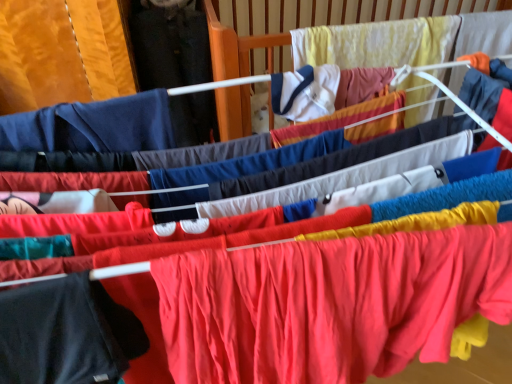
This screenshot has height=384, width=512. What do you see at coordinates (329, 304) in the screenshot? I see `matte red fabric at center, which is the 1th clothing from right to left` at bounding box center [329, 304].

Measure the distance between black matte t-shirt at lower left, positioned as the second clothing in right-to-left order, and camera.

They are 18.64 inches apart.

This screenshot has height=384, width=512. I want to click on black matte t-shirt at lower left, positioned as the second clothing in right-to-left order, so click(66, 333).

The height and width of the screenshot is (384, 512). Find the location of `yellow fabric infant bed at upper center`. yellow fabric infant bed at upper center is located at coordinates (237, 46).

Does black matte t-shirt at lower left, positioned as the second clothing in right-to-left order, have a greater width compared to matte red fabric at center, arranged as the second clothing when viewed from the left?

No.

Visually, is black matte t-shirt at lower left, acting as the first clothing starting from the left, positioned to the left or to the right of matte red fabric at center, arranged as the second clothing when viewed from the left?

Clearly, black matte t-shirt at lower left, acting as the first clothing starting from the left, is on the left of matte red fabric at center, arranged as the second clothing when viewed from the left, in the image.

How distant is black matte t-shirt at lower left, acting as the first clothing starting from the left, from matte red fabric at center, which is the 1th clothing from right to left?

black matte t-shirt at lower left, acting as the first clothing starting from the left, is 9.15 inches away from matte red fabric at center, which is the 1th clothing from right to left.

Considering the sizes of black matte t-shirt at lower left, acting as the first clothing starting from the left, and matte red fabric at center, which is the 1th clothing from right to left, in the image, is black matte t-shirt at lower left, acting as the first clothing starting from the left, taller or shorter than matte red fabric at center, which is the 1th clothing from right to left,?

Clearly, black matte t-shirt at lower left, acting as the first clothing starting from the left, is shorter compared to matte red fabric at center, which is the 1th clothing from right to left.

From a real-world perspective, is yellow fabric infant bed at upper center over black matte t-shirt at lower left, positioned as the second clothing in right-to-left order?

Indeed, from a real-world perspective, yellow fabric infant bed at upper center stands above black matte t-shirt at lower left, positioned as the second clothing in right-to-left order.

Considering the positions of objects yellow fabric infant bed at upper center and black matte t-shirt at lower left, positioned as the second clothing in right-to-left order, in the image provided, who is more to the left, yellow fabric infant bed at upper center or black matte t-shirt at lower left, positioned as the second clothing in right-to-left order,?

black matte t-shirt at lower left, positioned as the second clothing in right-to-left order, is more to the left.

The width and height of the screenshot is (512, 384). What are the coordinates of `infant bed that appears behind the black matte t-shirt at lower left, positioned as the second clothing in right-to-left order` in the screenshot? It's located at (237, 46).

In the scene shown: Which is less distant, [240,66] or [48,371]?

Point [240,66] appears to be farther away from the viewer than point [48,371].

Is black matte t-shirt at lower left, positioned as the second clothing in right-to-left order, in front of or behind yellow fabric infant bed at upper center in the image?

In the image, black matte t-shirt at lower left, positioned as the second clothing in right-to-left order, appears in front of yellow fabric infant bed at upper center.

Is black matte t-shirt at lower left, positioned as the second clothing in right-to-left order, taller than yellow fabric infant bed at upper center?

In fact, black matte t-shirt at lower left, positioned as the second clothing in right-to-left order, may be shorter than yellow fabric infant bed at upper center.

Is black matte t-shirt at lower left, acting as the first clothing starting from the left, facing away from yellow fabric infant bed at upper center?

No, black matte t-shirt at lower left, acting as the first clothing starting from the left, is not facing away from yellow fabric infant bed at upper center.

From the yellow fabric infant bed at upper center, count 1st clothings forward and point to it. Please provide its 2D coordinates.

[(329, 304)]

From a real-world perspective, which is physically below, yellow fabric infant bed at upper center or matte red fabric at center, which is the 1th clothing from right to left?

matte red fabric at center, which is the 1th clothing from right to left.

How far apart are yellow fabric infant bed at upper center and matte red fabric at center, arranged as the second clothing when viewed from the left?

The distance of yellow fabric infant bed at upper center from matte red fabric at center, arranged as the second clothing when viewed from the left, is 29.56 inches.

How different are the orientations of yellow fabric infant bed at upper center and matte red fabric at center, arranged as the second clothing when viewed from the left, in degrees?

1.07 degrees separate the facing orientations of yellow fabric infant bed at upper center and matte red fabric at center, arranged as the second clothing when viewed from the left.

Is matte red fabric at center, which is the 1th clothing from right to left, facing towards black matte t-shirt at lower left, acting as the first clothing starting from the left?

No, matte red fabric at center, which is the 1th clothing from right to left, is not aimed at black matte t-shirt at lower left, acting as the first clothing starting from the left.

Locate an element on the screen. This screenshot has width=512, height=384. clothing that is behind the black matte t-shirt at lower left, positioned as the second clothing in right-to-left order is located at coordinates (329, 304).

Looking at the image, does matte red fabric at center, which is the 1th clothing from right to left, seem bigger or smaller compared to black matte t-shirt at lower left, acting as the first clothing starting from the left?

Clearly, matte red fabric at center, which is the 1th clothing from right to left, is larger in size than black matte t-shirt at lower left, acting as the first clothing starting from the left.

In terms of height, does matte red fabric at center, arranged as the second clothing when viewed from the left, look taller or shorter compared to black matte t-shirt at lower left, acting as the first clothing starting from the left?

matte red fabric at center, arranged as the second clothing when viewed from the left, is taller than black matte t-shirt at lower left, acting as the first clothing starting from the left.

Considering the sizes of objects matte red fabric at center, which is the 1th clothing from right to left, and yellow fabric infant bed at upper center in the image provided, who is smaller, matte red fabric at center, which is the 1th clothing from right to left, or yellow fabric infant bed at upper center?

With smaller size is yellow fabric infant bed at upper center.

Is matte red fabric at center, which is the 1th clothing from right to left, far away from yellow fabric infant bed at upper center?

That's not correct — matte red fabric at center, which is the 1th clothing from right to left, is a little close to yellow fabric infant bed at upper center.

Is matte red fabric at center, which is the 1th clothing from right to left, at the left side of yellow fabric infant bed at upper center?

Indeed, matte red fabric at center, which is the 1th clothing from right to left, is positioned on the left side of yellow fabric infant bed at upper center.

Identify the location of clothing in front of the matte red fabric at center, arranged as the second clothing when viewed from the left. The image size is (512, 384). (66, 333).

Image resolution: width=512 pixels, height=384 pixels. Find the location of `the 1st clothing located beneath the yellow fabric infant bed at upper center (from a real-world perspective)`. the 1st clothing located beneath the yellow fabric infant bed at upper center (from a real-world perspective) is located at coordinates (66, 333).

Considering their positions, is matte red fabric at center, arranged as the second clothing when viewed from the left, positioned further to yellow fabric infant bed at upper center than black matte t-shirt at lower left, positioned as the second clothing in right-to-left order?

black matte t-shirt at lower left, positioned as the second clothing in right-to-left order, is positioned further to the anchor yellow fabric infant bed at upper center.

Considering their positions, is black matte t-shirt at lower left, positioned as the second clothing in right-to-left order, positioned further to yellow fabric infant bed at upper center than matte red fabric at center, which is the 1th clothing from right to left?

Based on the image, black matte t-shirt at lower left, positioned as the second clothing in right-to-left order, appears to be further to yellow fabric infant bed at upper center.

From the image, which object appears to be nearer to matte red fabric at center, which is the 1th clothing from right to left, yellow fabric infant bed at upper center or black matte t-shirt at lower left, acting as the first clothing starting from the left?

black matte t-shirt at lower left, acting as the first clothing starting from the left, lies closer to matte red fabric at center, which is the 1th clothing from right to left, than the other object.

Looking at the image, which one is located further to black matte t-shirt at lower left, positioned as the second clothing in right-to-left order, yellow fabric infant bed at upper center or matte red fabric at center, which is the 1th clothing from right to left?

yellow fabric infant bed at upper center is positioned further to the anchor black matte t-shirt at lower left, positioned as the second clothing in right-to-left order.

Based on their spatial positions, is black matte t-shirt at lower left, positioned as the second clothing in right-to-left order, or yellow fabric infant bed at upper center closer to matte red fabric at center, which is the 1th clothing from right to left?

black matte t-shirt at lower left, positioned as the second clothing in right-to-left order.

Looking at the image, which one is located closer to black matte t-shirt at lower left, acting as the first clothing starting from the left, matte red fabric at center, arranged as the second clothing when viewed from the left, or yellow fabric infant bed at upper center?

matte red fabric at center, arranged as the second clothing when viewed from the left.

Find the location of a particular element. This screenshot has width=512, height=384. clothing between black matte t-shirt at lower left, acting as the first clothing starting from the left, and yellow fabric infant bed at upper center in the front-back direction is located at coordinates (329, 304).